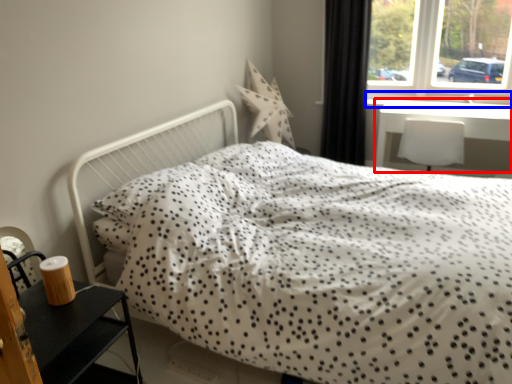
Question: Which object is further to the camera taking this photo, table (highlighted by a red box) or window sill (highlighted by a blue box)?

Choices:
 (A) table
 (B) window sill

Answer: (B)